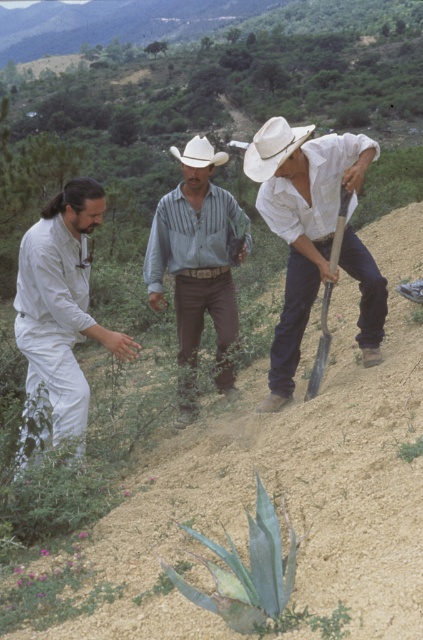
Is white matte suit at left closer to the viewer compared to wooden shovel at center?

That is True.

Is point (73, 300) positioned behind point (337, 241)?

No, (73, 300) is closer to viewer.

Where is `white matte suit at left`? Image resolution: width=423 pixels, height=640 pixels. white matte suit at left is located at coordinates (60, 312).

Between striped cotton shirt at center and white felt cowboy hat at center, which one has less height?

striped cotton shirt at center is shorter.

Which of these two, striped cotton shirt at center or white felt cowboy hat at center, stands taller?

Standing taller between the two is white felt cowboy hat at center.

What do you see at coordinates (197, 264) in the screenshot?
I see `striped cotton shirt at center` at bounding box center [197, 264].

Find the location of a particular element. Image resolution: width=423 pixels, height=640 pixels. striped cotton shirt at center is located at coordinates (197, 264).

Is white matte shirt at center bigger than striped cotton shirt at center?

No, white matte shirt at center is not bigger than striped cotton shirt at center.

Is white matte shirt at center wider than striped cotton shirt at center?

No, white matte shirt at center is not wider than striped cotton shirt at center.

You are a GUI agent. You are given a task and a screenshot of the screen. Output one action in this format:
    pyautogui.click(x=<x>, y=<y>)
    Task: Click on the white matte shirt at center
    
    Given the screenshot: What is the action you would take?
    pyautogui.click(x=302, y=221)